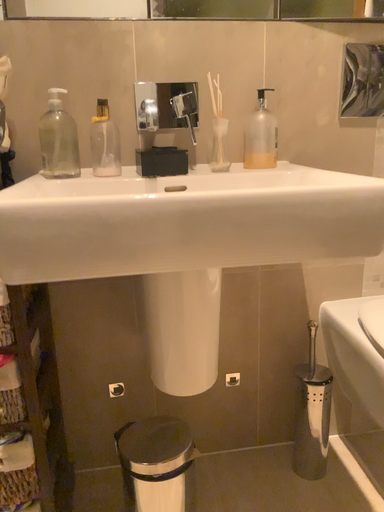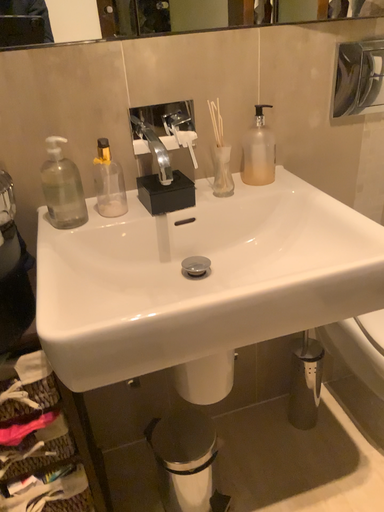
Question: Which way did the camera rotate in the video?

Choices:
 (A) rotated right
 (B) rotated left

Answer: (A)